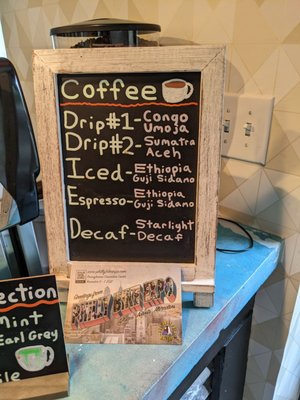
Where is `triangular cut in tile`? triangular cut in tile is located at coordinates (256, 65).